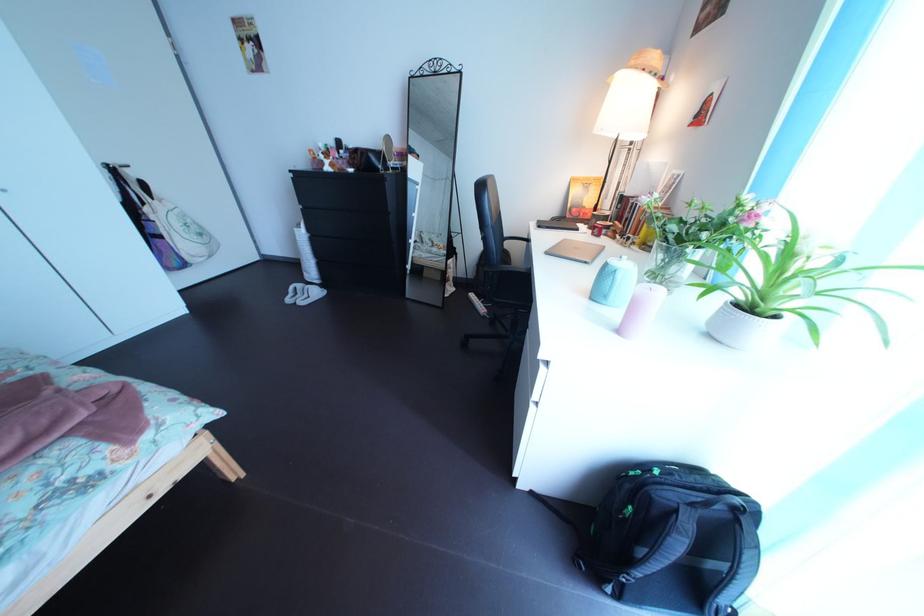
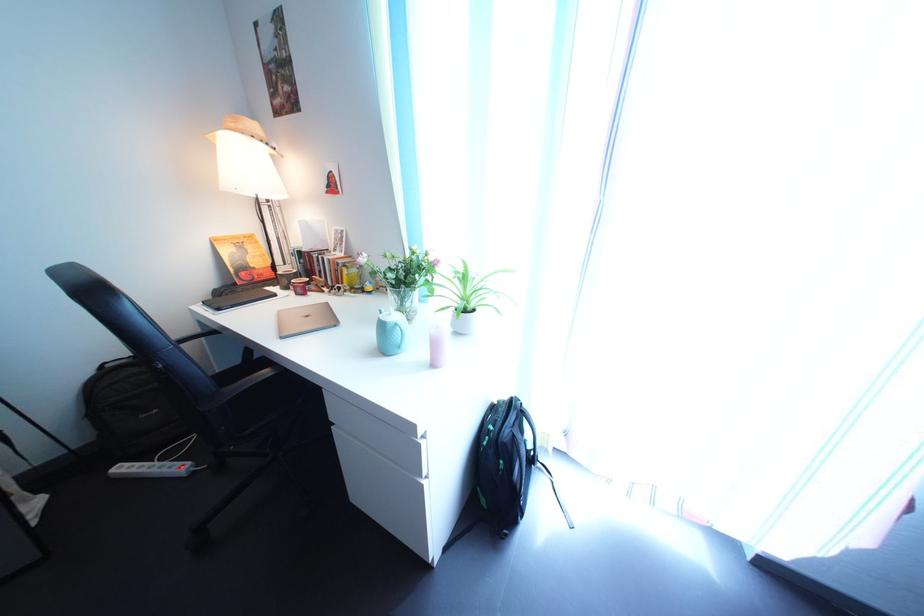
Question: The images are taken continuously from a first-person perspective. In which direction is your viewpoint rotating?

Choices:
 (A) Left
 (B) Right
 (C) Up
 (D) Down

Answer: (B)